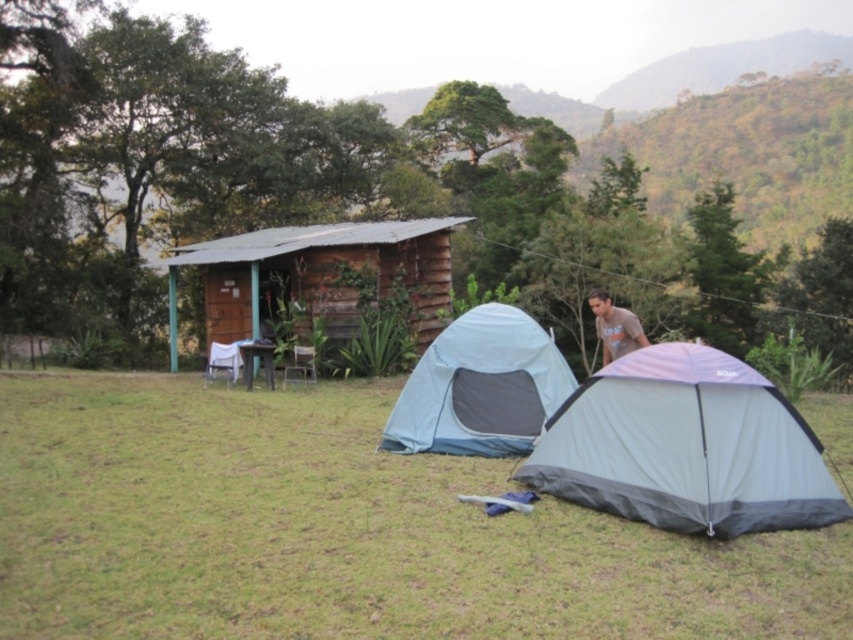
Is gray/black fabric tent at right positioned behind wooden log cabin at center?

No, it is not.

Who is positioned more to the left, gray/black fabric tent at right or wooden log cabin at center?

wooden log cabin at center

Locate an element on the screen. The height and width of the screenshot is (640, 853). gray/black fabric tent at right is located at coordinates (685, 445).

Does wooden log cabin at center appear under brown cotton shirt at upper right?

Incorrect, wooden log cabin at center is not positioned below brown cotton shirt at upper right.

Is point (437, 310) farther from viewer compared to point (613, 342)?

Yes, point (437, 310) is farther from viewer.

What do you see at coordinates (317, 275) in the screenshot? I see `wooden log cabin at center` at bounding box center [317, 275].

At what (x,y) coordinates should I click in order to perform the action: click on wooden log cabin at center. Please return your answer as a coordinate pair (x, y). This screenshot has height=640, width=853. Looking at the image, I should click on (317, 275).

Does green grass at lower center come in front of wooden log cabin at center?

Yes.

What are the coordinates of `green grass at lower center` in the screenshot? It's located at (341, 531).